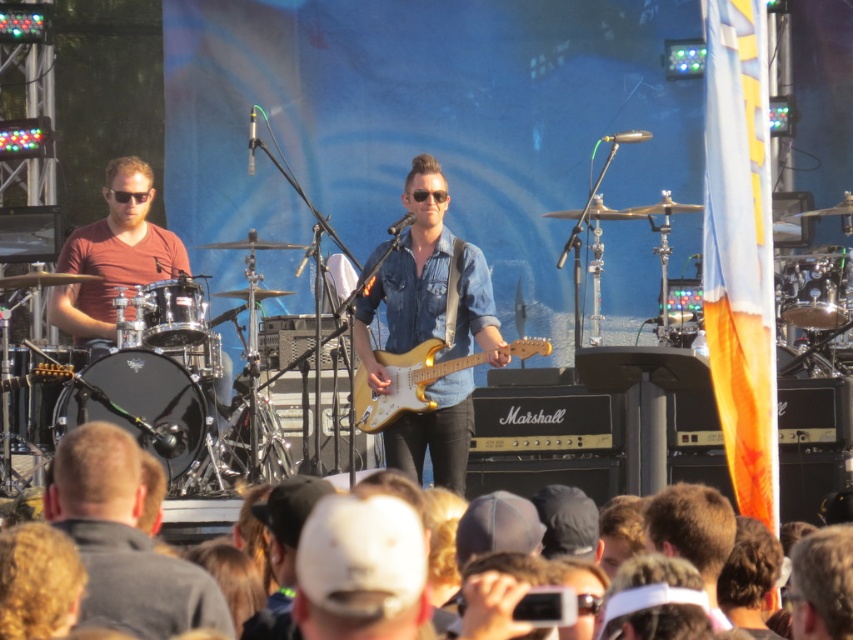
Who is positioned more to the left, glossy wood guitar at center or shiny silver drum at left?

shiny silver drum at left is more to the left.

Which is in front, point (366, 371) or point (167, 305)?

Point (167, 305)

Does point (374, 396) come in front of point (155, 285)?

No, it is not.

At what (x,y) coordinates should I click in order to perform the action: click on glossy wood guitar at center. Please return your answer as a coordinate pair (x, y). Looking at the image, I should click on (405, 384).

Can you confirm if denim shirt at center is positioned to the right of shiny silver drum at left?

Indeed, denim shirt at center is positioned on the right side of shiny silver drum at left.

Which is in front, point (459, 481) or point (152, 332)?

Positioned in front is point (152, 332).

Where is `denim shirt at center`? The image size is (853, 640). denim shirt at center is located at coordinates (408, 275).

Does shiny black drum at left have a larger size compared to matte red shirt at left?

Correct, shiny black drum at left is larger in size than matte red shirt at left.

Based on the photo, is shiny black drum at left wider than matte red shirt at left?

Indeed, shiny black drum at left has a greater width compared to matte red shirt at left.

In the scene shown: Who is more distant from viewer, (54, 509) or (93, 240)?

Point (93, 240)

Find the location of a particular element. shiny black drum at left is located at coordinates (123, 541).